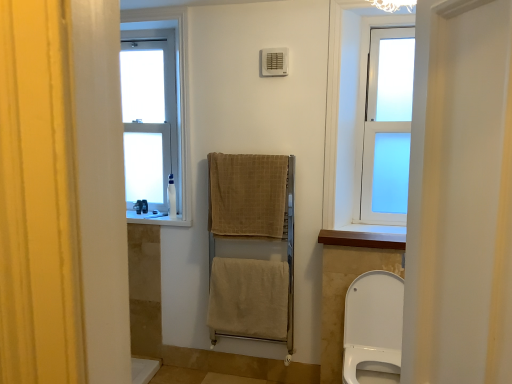
Question: Is beige cotton towel at center, arranged as the 3th bath towel when viewed from the top, taller or shorter than white frosted glass window at upper right, which ranks as the 2th window in left-to-right order?

Choices:
 (A) tall
 (B) short

Answer: (B)

Question: Considering their positions, is beige cotton towel at center, positioned as the first bath towel in bottom-to-top order, located in front of or behind white frosted glass window at upper right, which ranks as the 2th window in left-to-right order?

Choices:
 (A) behind
 (B) front

Answer: (A)

Question: Considering the real-world distances, which object is farthest from the beige woven towel at center, the 3th bath towel from the bottom?

Choices:
 (A) white frosted glass window at upper right, the first window in the front-to-back sequence
 (B) white frosted glass window at upper left, which is the 1th window in left-to-right order
 (C) white plastic bottle at left, which is the second toiletry from back to front
 (D) white plastic bottle at left, the first toiletry from the left
 (E) beige woven towel at center, the second bath towel when ordered from top to bottom

Answer: (D)

Question: Estimate the real-world distances between objects in this image. Which object is farther from the white plastic window sill at center, the 2th window sill in the right-to-left sequence?

Choices:
 (A) white frosted glass window at upper left, the 1th window positioned from the back
 (B) white plastic bottle at left, arranged as the second toiletry when viewed from the right
 (C) wooden at upper center, which is the second window sill from left to right
 (D) white plastic bottle at left, the 1th toiletry when ordered from front to back
 (E) beige cotton towel at center, positioned as the first bath towel in bottom-to-top order

Answer: (C)